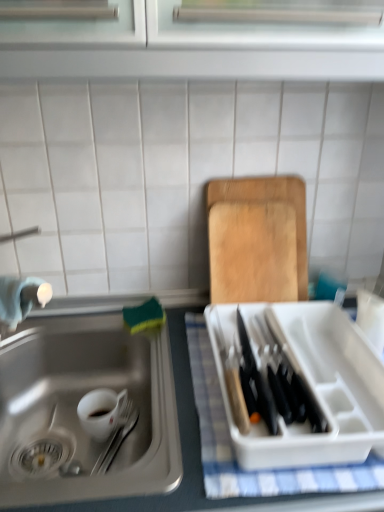
What do you see at coordinates (232, 449) in the screenshot? This screenshot has height=512, width=384. I see `white checkered cloth at right` at bounding box center [232, 449].

The width and height of the screenshot is (384, 512). I want to click on wooden cutting board at upper right, so (257, 240).

How distant is white checkered cloth at right from wooden cutting board at upper right?

white checkered cloth at right is 9.75 inches from wooden cutting board at upper right.

From the picture: Considering the sizes of white checkered cloth at right and wooden cutting board at upper right in the image, is white checkered cloth at right wider or thinner than wooden cutting board at upper right?

In the image, white checkered cloth at right appears to be wider than wooden cutting board at upper right.

Is white checkered cloth at right turned away from wooden cutting board at upper right?

Yes, white checkered cloth at right is positioned with its back facing wooden cutting board at upper right.

From the image's perspective, is white checkered cloth at right under wooden cutting board at upper right?

Indeed, from the image's perspective, white checkered cloth at right is shown beneath wooden cutting board at upper right.

Can we say white glossy mug at lower left lies outside stainless steel sink at lower left?

No, most part of white glossy mug at lower left lies within stainless steel sink at lower left.

How distant is white glossy mug at lower left from stainless steel sink at lower left?

5.61 inches.

Could you tell me if white glossy mug at lower left is turned towards stainless steel sink at lower left?

Yes, white glossy mug at lower left is facing stainless steel sink at lower left.

Considering the relative sizes of white glossy mug at lower left and stainless steel sink at lower left in the image provided, is white glossy mug at lower left bigger than stainless steel sink at lower left?

No, white glossy mug at lower left is not bigger than stainless steel sink at lower left.

From a real-world perspective, which is physically below, wooden cutting board at upper right or stainless steel sink at lower left?

stainless steel sink at lower left is physically lower.

Who is taller, wooden cutting board at upper right or stainless steel sink at lower left?

wooden cutting board at upper right.

Between wooden cutting board at upper right and stainless steel sink at lower left, which one has smaller size?

wooden cutting board at upper right is smaller.

Is stainless steel sink at lower left located outside wooden cutting board at upper right?

Yes.

Is stainless steel sink at lower left in front of wooden cutting board at upper right?

That is True.

From the image's perspective, is stainless steel sink at lower left beneath wooden cutting board at upper right?

Yes, from the image's perspective, stainless steel sink at lower left is below wooden cutting board at upper right.

Locate an element on the screen. This screenshot has height=512, width=384. tablecloth that appears above the white glossy mug at lower left (from the image's perspective) is located at coordinates (232, 449).

Looking at the image, does white checkered cloth at right seem bigger or smaller compared to white glossy mug at lower left?

white checkered cloth at right is bigger than white glossy mug at lower left.

Is white checkered cloth at right facing away from white glossy mug at lower left?

No, white checkered cloth at right's orientation is not away from white glossy mug at lower left.

Is white checkered cloth at right inside or outside of white glossy mug at lower left?

white checkered cloth at right is spatially situated outside white glossy mug at lower left.

Is stainless steel sink at lower left with white checkered cloth at right?

No.

Choose the correct answer: Is stainless steel sink at lower left inside white checkered cloth at right or outside it?

stainless steel sink at lower left is not enclosed by white checkered cloth at right.

Which point is more forward, (143, 439) or (187, 341)?

Point (143, 439)

Consider the image. Looking at their sizes, would you say stainless steel sink at lower left is wider or thinner than white checkered cloth at right?

Considering their sizes, stainless steel sink at lower left looks broader than white checkered cloth at right.

Does wooden cutting board at upper right appear on the left side of white glossy mug at lower left?

Incorrect, wooden cutting board at upper right is not on the left side of white glossy mug at lower left.

Does wooden cutting board at upper right have a smaller size compared to white glossy mug at lower left?

Incorrect, wooden cutting board at upper right is not smaller in size than white glossy mug at lower left.

From a real-world perspective, does wooden cutting board at upper right stand above white glossy mug at lower left?

Yes.

Would you say wooden cutting board at upper right is inside or outside white glossy mug at lower left?

wooden cutting board at upper right is not enclosed by white glossy mug at lower left.

This screenshot has width=384, height=512. I want to click on cutting board located on the left of white checkered cloth at right, so click(257, 240).

Find the location of a particular element. The height and width of the screenshot is (512, 384). tableware that is under the stainless steel sink at lower left (from a real-world perspective) is located at coordinates (102, 412).

Based on their spatial positions, is white checkered cloth at right or wooden cutting board at upper right closer to white glossy mug at lower left?

Based on the image, white checkered cloth at right appears to be nearer to white glossy mug at lower left.

Looking at the image, which one is located closer to white glossy mug at lower left, stainless steel sink at lower left or wooden cutting board at upper right?

stainless steel sink at lower left.

Looking at this image, considering their positions, is white checkered cloth at right positioned further to stainless steel sink at lower left than wooden cutting board at upper right?

wooden cutting board at upper right is positioned further to the anchor stainless steel sink at lower left.

Which object lies further to the anchor point stainless steel sink at lower left, white glossy mug at lower left or white checkered cloth at right?

white checkered cloth at right lies further to stainless steel sink at lower left than the other object.

Based on their spatial positions, is stainless steel sink at lower left or wooden cutting board at upper right further from white checkered cloth at right?

wooden cutting board at upper right.

Which object lies nearer to the anchor point white checkered cloth at right, wooden cutting board at upper right or white glossy mug at lower left?

wooden cutting board at upper right is closer to white checkered cloth at right.

Looking at the image, which one is located further to wooden cutting board at upper right, white glossy mug at lower left or stainless steel sink at lower left?

white glossy mug at lower left is positioned further to the anchor wooden cutting board at upper right.

Which object lies nearer to the anchor point wooden cutting board at upper right, white glossy mug at lower left or white checkered cloth at right?

white checkered cloth at right is closer to wooden cutting board at upper right.

Where is `tableware between stainless steel sink at lower left and wooden cutting board at upper right in the horizontal direction`? tableware between stainless steel sink at lower left and wooden cutting board at upper right in the horizontal direction is located at coordinates (102, 412).

You are a GUI agent. You are given a task and a screenshot of the screen. Output one action in this format:
    pyautogui.click(x=<x>, y=<y>)
    Task: Click on the tableware situated between stainless steel sink at lower left and white checkered cloth at right from left to right
    This screenshot has height=512, width=384.
    Given the screenshot: What is the action you would take?
    pyautogui.click(x=102, y=412)

Where is `cutting board between stainless steel sink at lower left and white checkered cloth at right in the horizontal direction`? The height and width of the screenshot is (512, 384). cutting board between stainless steel sink at lower left and white checkered cloth at right in the horizontal direction is located at coordinates (257, 240).

Where is `cutting board between white glossy mug at lower left and white checkered cloth at right`? cutting board between white glossy mug at lower left and white checkered cloth at right is located at coordinates (257, 240).